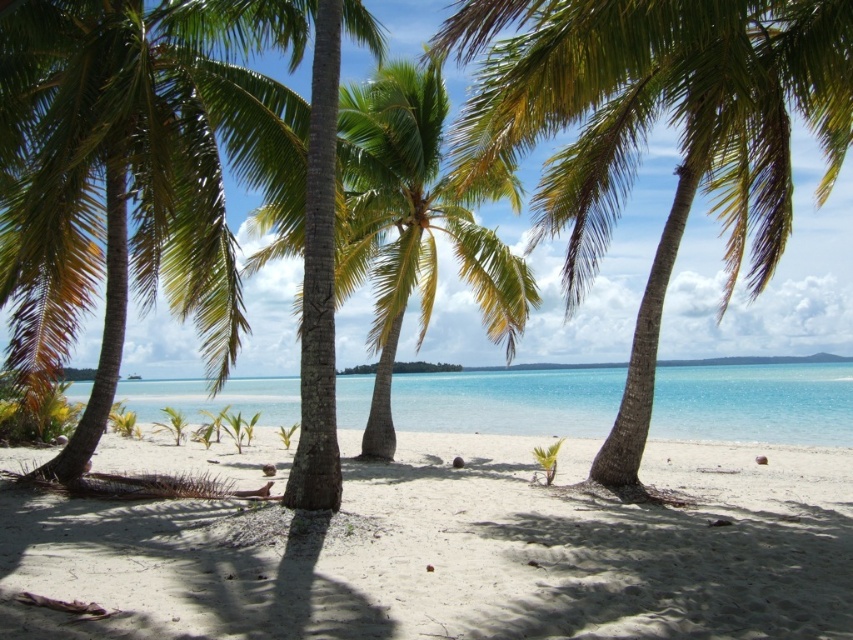
You are standing on the beach and want to take a photo of both the green leafy palm tree at center and the clear blue water at center. Which object should you focus on first if you want both to be in sharp focus?

You should focus on the green leafy palm tree at center first because it is closer to you than the clear blue water at center, ensuring both will be in focus when using a camera with proper depth of field settings.

You are standing on the beach and want to take a photo that includes both the green leafy palm tree at center and the green leafy palm tree at left. Which tree should you move closer to in order to include both in your photo?

You should move closer to the green leafy palm tree at center because it occupies less space than the green leafy palm tree at left, allowing you to frame both within the camera view more easily.

You are standing on the beach looking towards the ocean. Which object, the green leafy palm tree at left or the clear blue water at center, is closer to you?

The green leafy palm tree at left is closer to you because it is positioned in front of the clear blue water at center.